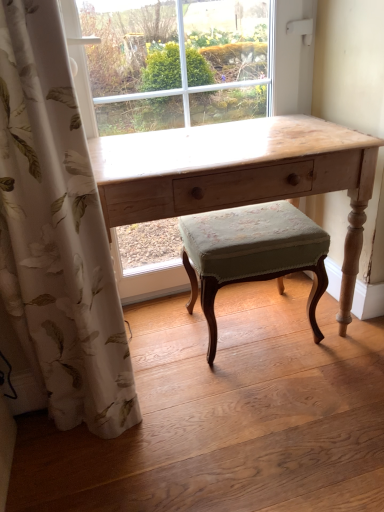
Identify the location of free spot in front of light wood desk at center. pos(246,432).